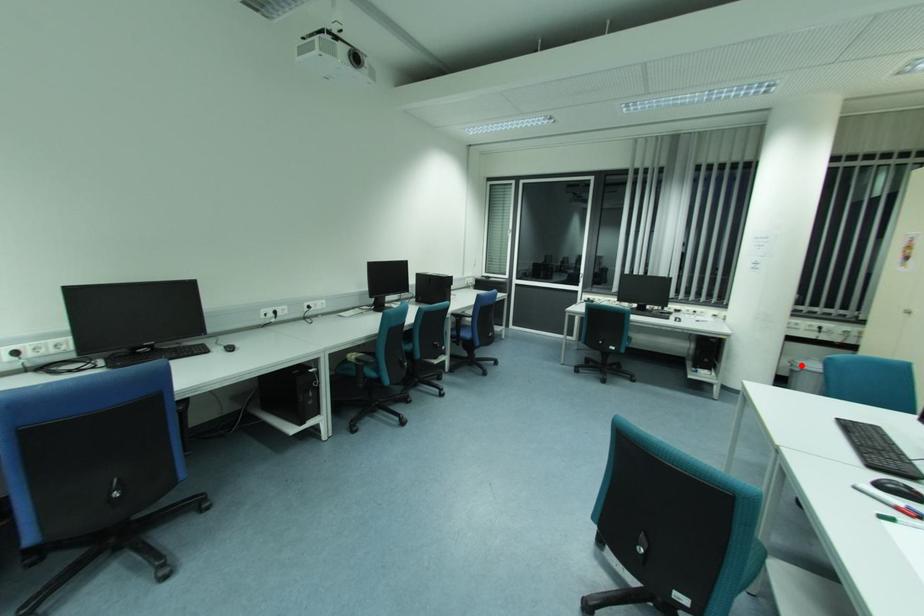
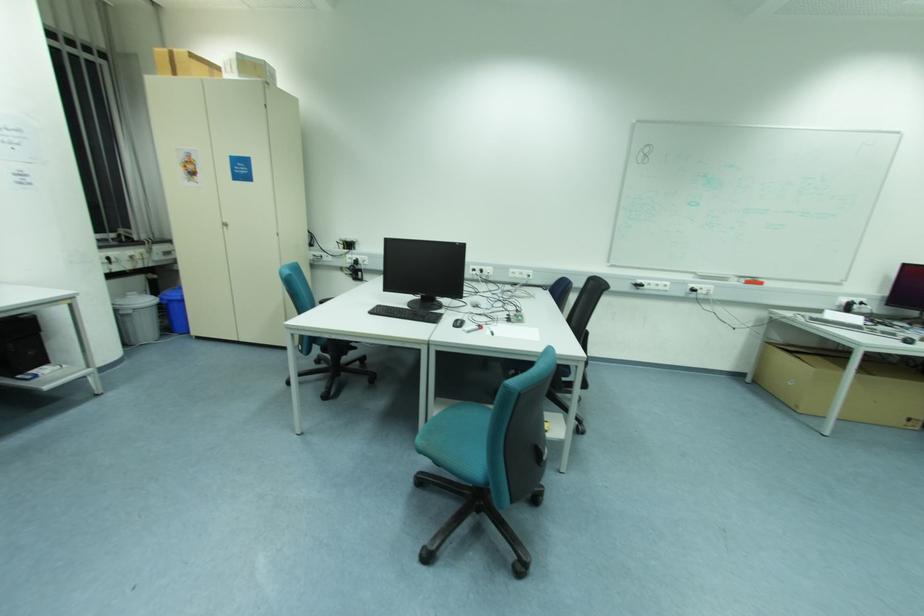
Question: I am providing you with two images of the same scene from different viewpoints. Given a red point in image1, look at the same physical point in image2. Is it:

Choices:
 (A) Closer to the viewpoint
 (B) Farther from the viewpoint

Answer: (A)